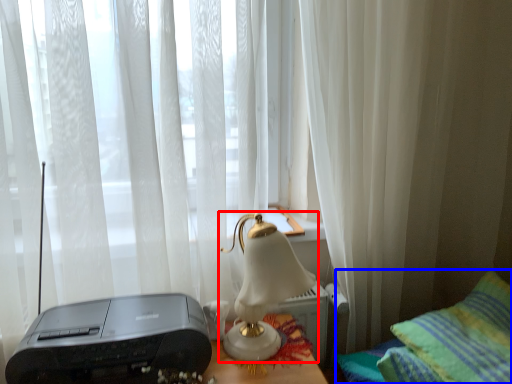
Question: Which point is closer to the camera, lamp (highlighted by a red box) or furniture (highlighted by a blue box)?

Choices:
 (A) lamp
 (B) furniture

Answer: (B)